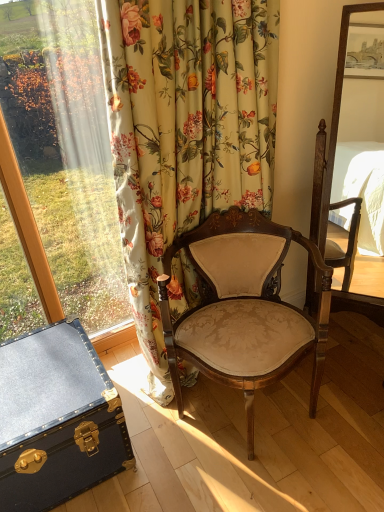
This screenshot has width=384, height=512. I want to click on free region under matte beige fabric chair at center (from a real-world perspective), so click(x=258, y=414).